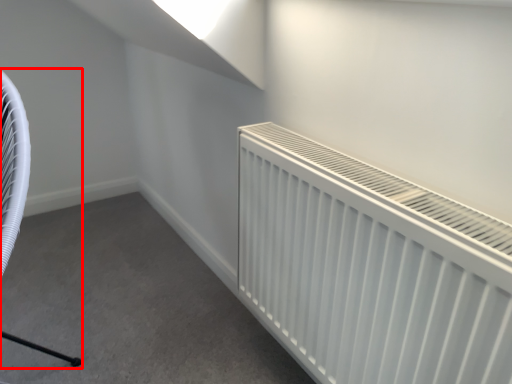
Question: In this image, where is swivel chair (annotated by the red box) located relative to radiator?

Choices:
 (A) left
 (B) right

Answer: (A)